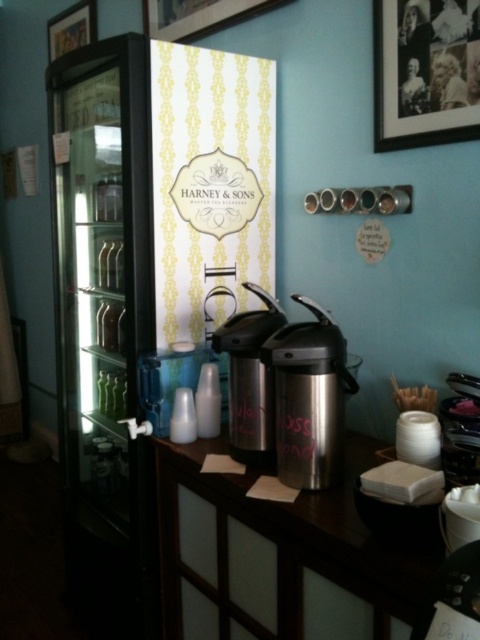
Which is more to the left, stainless steel carafe at center or wooden picture frame at upper left?

wooden picture frame at upper left is more to the left.

Can you confirm if stainless steel carafe at center is positioned to the right of wooden picture frame at upper left?

Indeed, stainless steel carafe at center is positioned on the right side of wooden picture frame at upper left.

Does point (269, 346) come in front of point (93, 16)?

Yes, it is.

Where is `stainless steel carafe at center`? The width and height of the screenshot is (480, 640). stainless steel carafe at center is located at coordinates (309, 397).

Which is below, stainless steel carafe at center or transparent plastic bottle at center?

transparent plastic bottle at center

Is stainless steel carafe at center shorter than transparent plastic bottle at center?

No, stainless steel carafe at center is not shorter than transparent plastic bottle at center.

Between point (288, 332) and point (201, 387), which one is positioned in front?

Point (288, 332) is more forward.

Locate an element on the screen. stainless steel carafe at center is located at coordinates (309, 397).

Can you confirm if wooden picture frame at upper center is positioned to the left of wooden picture frame at upper left?

In fact, wooden picture frame at upper center is to the right of wooden picture frame at upper left.

Locate an element on the screen. wooden picture frame at upper center is located at coordinates (199, 16).

Where is `wooden picture frame at upper center`? wooden picture frame at upper center is located at coordinates (199, 16).